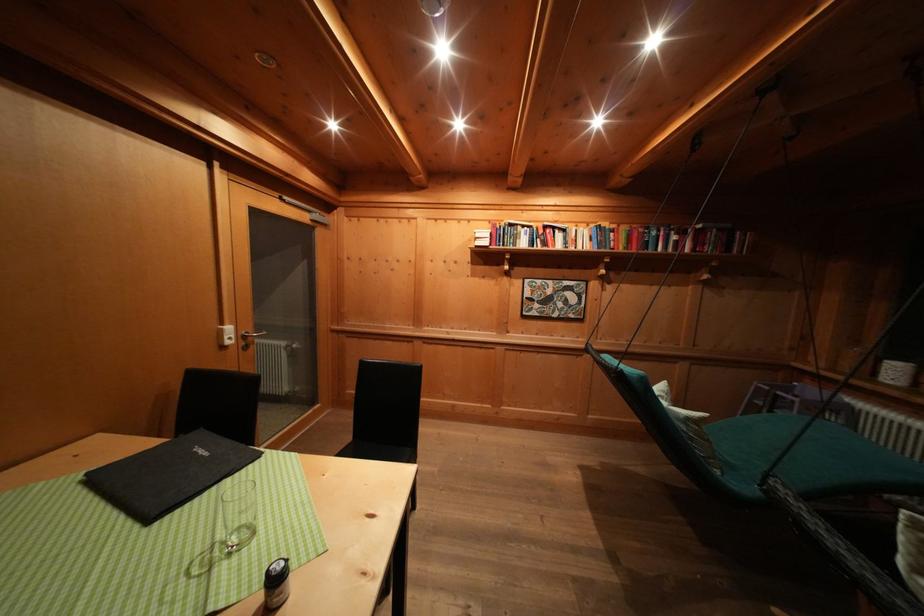
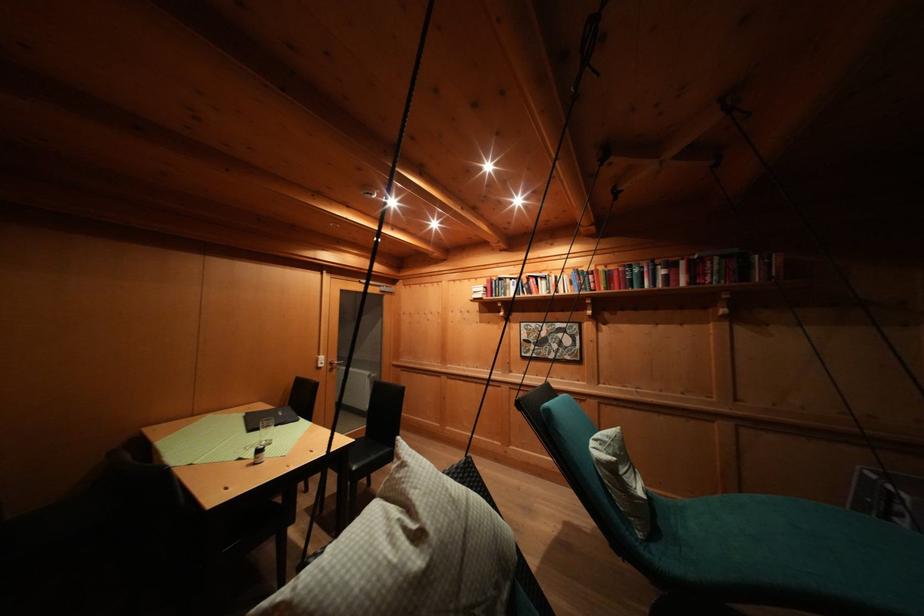
Question: The images are taken continuously from a first-person perspective. In which direction are you moving?

Choices:
 (A) Left
 (B) Right
 (C) Forward
 (D) Backward

Answer: (B)